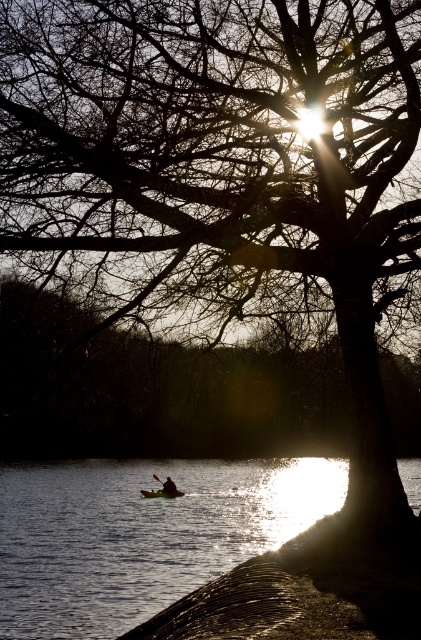
Question: Among these points, which one is nearest to the camera?

Choices:
 (A) (117, 461)
 (B) (170, 490)

Answer: (B)

Question: Is dark brown leather kayak at center further to camera compared to black rubber paddle at center?

Choices:
 (A) yes
 (B) no

Answer: (B)

Question: In this image, where is silvery reflective water at lower left located relative to black rubber paddle at center?

Choices:
 (A) left
 (B) right

Answer: (B)

Question: Does silvery reflective water at lower left have a greater width compared to dark brown leather kayak at center?

Choices:
 (A) no
 (B) yes

Answer: (B)

Question: Which of these objects is positioned closest to the black rubber paddle at center?

Choices:
 (A) dark brown leather kayak at center
 (B) silvery reflective water at lower left

Answer: (A)

Question: Which point is farther to the camera?

Choices:
 (A) dark brown leather kayak at center
 (B) black rubber paddle at center
 (C) silvery reflective water at lower left

Answer: (B)